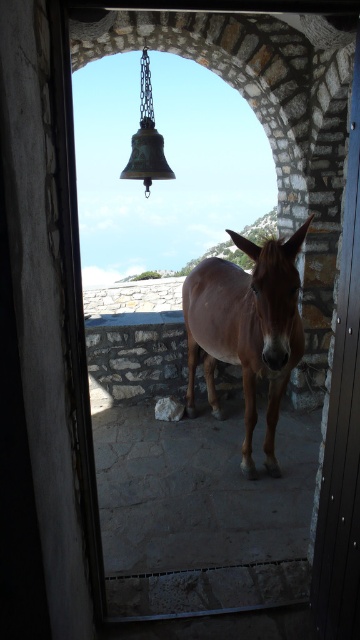
You are standing in the courtyard and want to approach the brown matte mule at center. If you walk straight ahead from your current position, will you be able to reach the mule without moving sideways?

Yes, because the brown matte mule at center is directly in front of you, and the distance of 2.74 meters can be covered by walking straight ahead.

Consider the image. You are a visitor standing in the courtyard and want to enter the metallic gray door at center. The brown matte mule at center is blocking your path. Can you walk around the mule to reach the door?

The brown matte mule at center is larger in size than the metallic gray door at center, so it is possible to walk around the mule to reach the door since the mule is bigger and might have space around it.